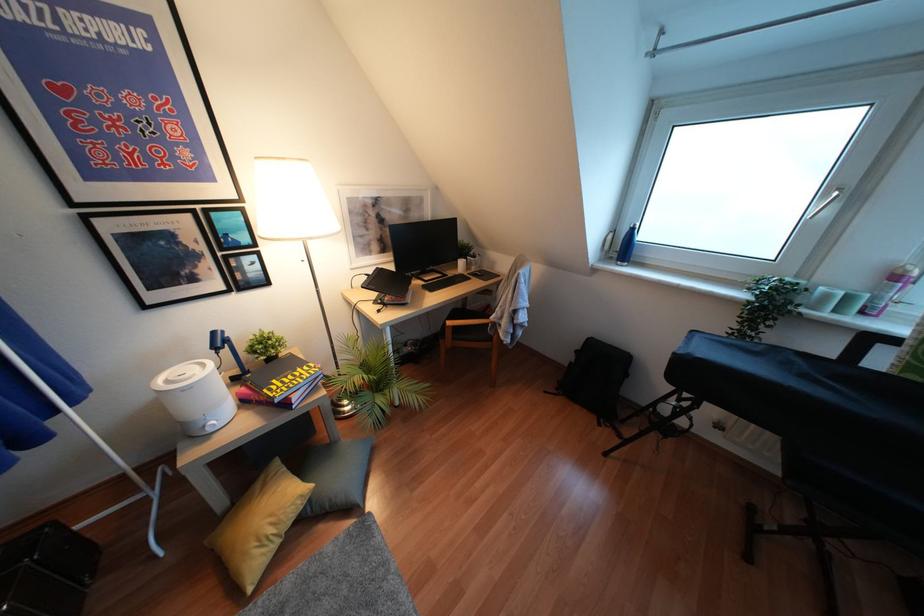
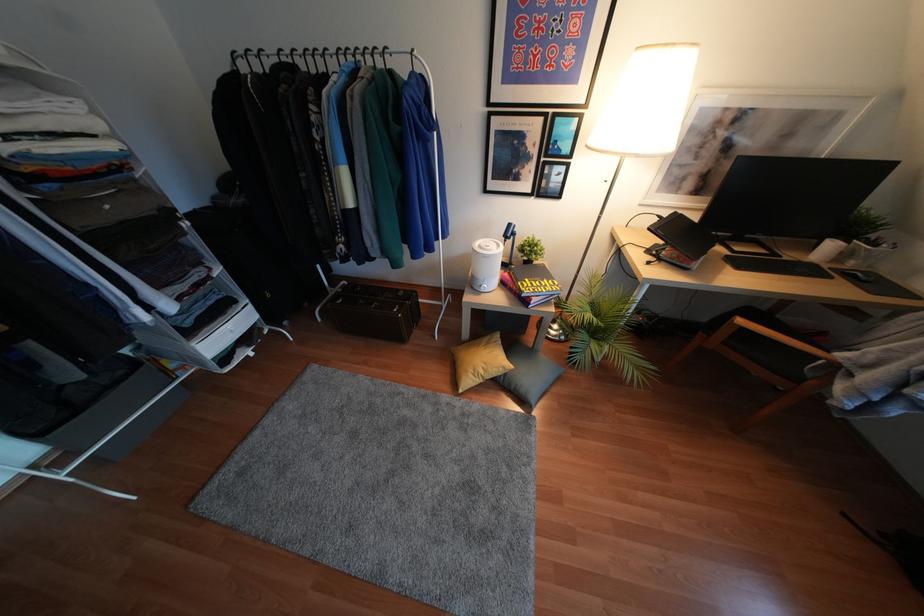
The point at (210, 430) is marked in the first image. Where is the corresponding point in the second image?

(481, 290)